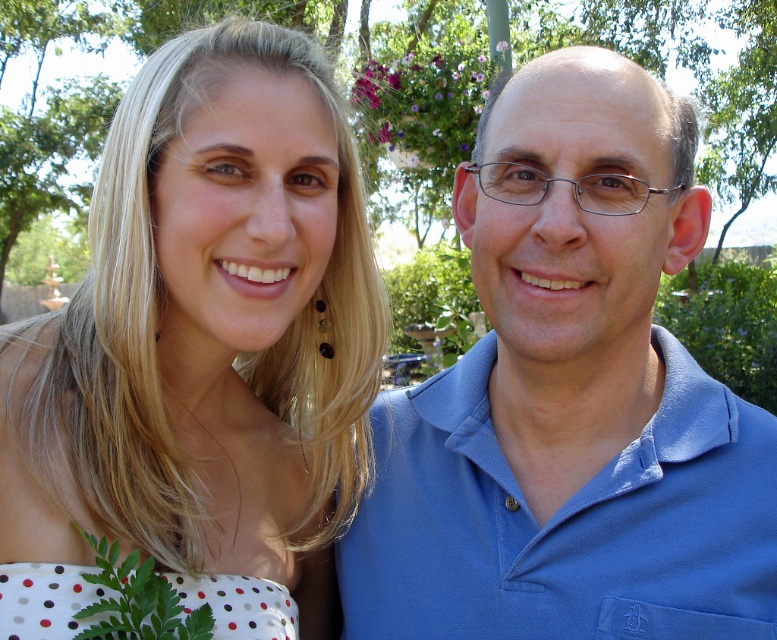
Who is positioned more to the right, blue cotton shirt at right or white polka dot fabric at lower left?

blue cotton shirt at right is more to the right.

Is blue cotton shirt at right to the right of white polka dot fabric at lower left from the viewer's perspective?

Correct, you'll find blue cotton shirt at right to the right of white polka dot fabric at lower left.

Which is behind, point (598, 445) or point (239, 593)?

Point (598, 445)

In order to click on blue cotton shirt at right in this screenshot , I will do `click(570, 400)`.

Can you confirm if white dotted dress at left is thinner than blue cotton shirt at right?

Correct, white dotted dress at left's width is less than blue cotton shirt at right's.

Does white dotted dress at left have a smaller size compared to blue cotton shirt at right?

Actually, white dotted dress at left might be larger than blue cotton shirt at right.

Which is in front, point (40, 410) or point (429, 472)?

Point (40, 410) is in front.

In order to click on white dotted dress at left in this screenshot , I will do `click(201, 348)`.

Who is positioned more to the left, white dotted dress at left or white polka dot fabric at lower left?

white dotted dress at left

Does white dotted dress at left have a greater width compared to white polka dot fabric at lower left?

Yes.

Is point (274, 212) farther from camera compared to point (91, 586)?

Yes, it is behind point (91, 586).

Find the location of a particular element. This screenshot has width=777, height=640. white dotted dress at left is located at coordinates (201, 348).